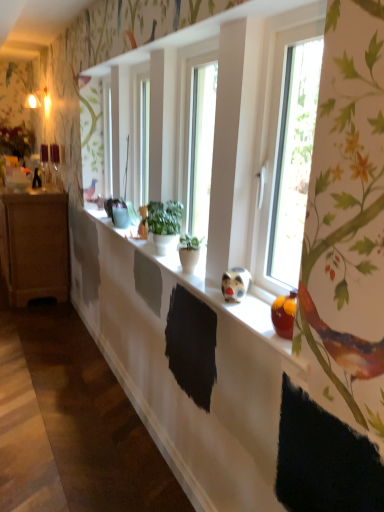
The width and height of the screenshot is (384, 512). Find the location of `transparent glass window at right`. transparent glass window at right is located at coordinates (289, 155).

Locate an element on the screen. Image resolution: width=384 pixels, height=512 pixels. transparent glass window at right is located at coordinates (289, 155).

Consider the image. From a real-world perspective, which object stands above the other?

transparent glass window at right, from a real-world perspective.

Between transparent glass window at right and matte brown cabinet at left, which one has more height?

With more height is matte brown cabinet at left.

Is transparent glass window at right situated inside matte brown cabinet at left or outside?

transparent glass window at right is not inside matte brown cabinet at left, it's outside.

Which object is positioned more to the left, transparent glass window at right or matte brown cabinet at left?

matte brown cabinet at left is more to the left.

Considering the sizes of objects green matte plant pot at center, which is counted as the 1th houseplant, starting from the front, and green matte plant at center, the first houseplant from the back, in the image provided, who is bigger, green matte plant pot at center, which is counted as the 1th houseplant, starting from the front, or green matte plant at center, the first houseplant from the back,?

With larger size is green matte plant at center, the first houseplant from the back.

Who is taller, green matte plant pot at center, which is counted as the 1th houseplant, starting from the front, or green matte plant at center, placed as the second houseplant when sorted from front to back?

green matte plant at center, placed as the second houseplant when sorted from front to back.

Is green matte plant pot at center, positioned as the second houseplant in back-to-front order, in front of or behind green matte plant at center, placed as the second houseplant when sorted from front to back, in the image?

Clearly, green matte plant pot at center, positioned as the second houseplant in back-to-front order, is in front of green matte plant at center, placed as the second houseplant when sorted from front to back.

Which is farther, [186,257] or [161,222]?

The point [161,222] is behind.

Is matte brown cabinet at left situated inside transparent glass window at right or outside?

matte brown cabinet at left is not inside transparent glass window at right, it's outside.

The width and height of the screenshot is (384, 512). In order to click on cabinetry directly beneath the transparent glass window at right (from a real-world perspective) in this screenshot , I will do `click(34, 244)`.

Can you see matte brown cabinet at left touching transparent glass window at right?

No, matte brown cabinet at left is not making contact with transparent glass window at right.

Which is closer, (22, 294) or (313, 54)?

The point (313, 54) is more forward.

Is green matte plant at center, the first houseplant from the back, positioned beyond the bounds of green matte plant pot at center, which is counted as the 1th houseplant, starting from the front?

Yes, green matte plant at center, the first houseplant from the back, is not within green matte plant pot at center, which is counted as the 1th houseplant, starting from the front.

From a real-world perspective, who is located higher, green matte plant at center, the first houseplant from the back, or green matte plant pot at center, which is counted as the 1th houseplant, starting from the front?

green matte plant at center, the first houseplant from the back, is physically above.

From the image's perspective, between green matte plant at center, the first houseplant from the back, and green matte plant pot at center, positioned as the second houseplant in back-to-front order, which one is located above?

green matte plant at center, the first houseplant from the back.

Is green matte plant at center, the first houseplant from the back, beside green matte plant pot at center, positioned as the second houseplant in back-to-front order?

No, green matte plant at center, the first houseplant from the back, is not with green matte plant pot at center, positioned as the second houseplant in back-to-front order.

From their relative heights in the image, would you say transparent glass window at right is taller or shorter than green matte plant at center, placed as the second houseplant when sorted from front to back?

Clearly, transparent glass window at right is taller compared to green matte plant at center, placed as the second houseplant when sorted from front to back.

Considering the positions of point (287, 101) and point (166, 243), is point (287, 101) closer or farther from the camera than point (166, 243)?

Point (287, 101) is positioned closer to the camera compared to point (166, 243).

How distant is transparent glass window at right from green matte plant at center, placed as the second houseplant when sorted from front to back?

The distance of transparent glass window at right from green matte plant at center, placed as the second houseplant when sorted from front to back, is 26.14 inches.

Would you consider transparent glass window at right to be distant from green matte plant at center, placed as the second houseplant when sorted from front to back?

Actually, transparent glass window at right and green matte plant at center, placed as the second houseplant when sorted from front to back, are a little close together.

From the image's perspective, is green matte plant at center, the first houseplant from the back, below matte brown cabinet at left?

Correct, green matte plant at center, the first houseplant from the back, appears lower than matte brown cabinet at left in the image.

Consider the image. Based on their sizes in the image, would you say green matte plant at center, placed as the second houseplant when sorted from front to back, is bigger or smaller than matte brown cabinet at left?

green matte plant at center, placed as the second houseplant when sorted from front to back, is smaller than matte brown cabinet at left.

Considering the relative sizes of green matte plant at center, placed as the second houseplant when sorted from front to back, and matte brown cabinet at left in the image provided, is green matte plant at center, placed as the second houseplant when sorted from front to back, thinner than matte brown cabinet at left?

Indeed, green matte plant at center, placed as the second houseplant when sorted from front to back, has a lesser width compared to matte brown cabinet at left.

Who is more distant, green matte plant pot at center, which is counted as the 1th houseplant, starting from the front, or matte brown cabinet at left?

matte brown cabinet at left.

Considering the sizes of objects green matte plant pot at center, which is counted as the 1th houseplant, starting from the front, and matte brown cabinet at left in the image provided, who is smaller, green matte plant pot at center, which is counted as the 1th houseplant, starting from the front, or matte brown cabinet at left?

Smaller between the two is green matte plant pot at center, which is counted as the 1th houseplant, starting from the front.

Does point (186, 234) come behind point (24, 286)?

No, it is not.

Image resolution: width=384 pixels, height=512 pixels. I want to click on window that is on the right side of matte brown cabinet at left, so click(x=289, y=155).

At what (x,y) coordinates should I click in order to perform the action: click on houseplant on the left of the green matte plant pot at center, which is counted as the 1th houseplant, starting from the front. Please return your answer as a coordinate pair (x, y). Image resolution: width=384 pixels, height=512 pixels. Looking at the image, I should click on (164, 225).

Which object lies nearer to the anchor point matte brown cabinet at left, transparent glass window at right or green matte plant at center, placed as the second houseplant when sorted from front to back?

green matte plant at center, placed as the second houseplant when sorted from front to back.

Based on their spatial positions, is matte brown cabinet at left or green matte plant at center, the first houseplant from the back, further from white matte window sill at center?

matte brown cabinet at left is positioned further to the anchor white matte window sill at center.

Which object lies nearer to the anchor point transparent glass window at right, green matte plant at center, the first houseplant from the back, or white matte window sill at center?

white matte window sill at center.

From the picture: From the image, which object appears to be nearer to green matte plant at center, placed as the second houseplant when sorted from front to back, matte brown cabinet at left or green matte plant pot at center, which is counted as the 1th houseplant, starting from the front?

Among the two, green matte plant pot at center, which is counted as the 1th houseplant, starting from the front, is located nearer to green matte plant at center, placed as the second houseplant when sorted from front to back.

When comparing their distances from white matte window sill at center, does transparent glass window at right or matte brown cabinet at left seem further?

Among the two, matte brown cabinet at left is located further to white matte window sill at center.

Based on their spatial positions, is white matte window sill at center or transparent glass window at right closer to green matte plant at center, placed as the second houseplant when sorted from front to back?

Based on the image, white matte window sill at center appears to be nearer to green matte plant at center, placed as the second houseplant when sorted from front to back.

Looking at the image, which one is located closer to green matte plant at center, placed as the second houseplant when sorted from front to back, matte brown cabinet at left or transparent glass window at right?

The object closer to green matte plant at center, placed as the second houseplant when sorted from front to back, is transparent glass window at right.

Considering their positions, is green matte plant at center, placed as the second houseplant when sorted from front to back, positioned closer to white matte window sill at center than matte brown cabinet at left?

The object closer to white matte window sill at center is green matte plant at center, placed as the second houseplant when sorted from front to back.

At what (x,y) coordinates should I click in order to perform the action: click on window sill between transparent glass window at right and matte brown cabinet at left from front to back. Please return your answer as a coordinate pair (x, y). Looking at the image, I should click on (231, 304).

Find the location of `window sill between transparent glass window at right and green matte plant pot at center, positioned as the second houseplant in back-to-front order, from front to back`. window sill between transparent glass window at right and green matte plant pot at center, positioned as the second houseplant in back-to-front order, from front to back is located at coordinates (231, 304).

Find the location of `houseplant between transparent glass window at right and green matte plant at center, placed as the second houseplant when sorted from front to back, along the z-axis`. houseplant between transparent glass window at right and green matte plant at center, placed as the second houseplant when sorted from front to back, along the z-axis is located at coordinates (189, 252).

Identify the location of houseplant between matte brown cabinet at left and green matte plant pot at center, positioned as the second houseplant in back-to-front order. (164, 225).